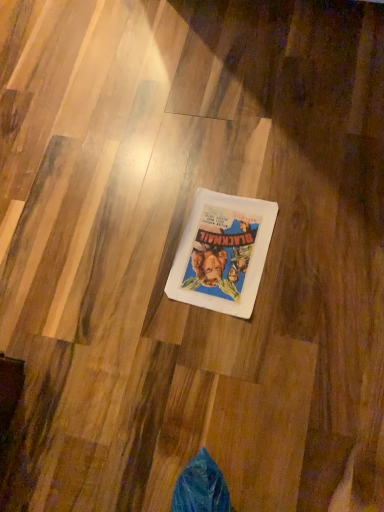
This screenshot has height=512, width=384. I want to click on free space to the back side of white matte book cover at center, so click(192, 160).